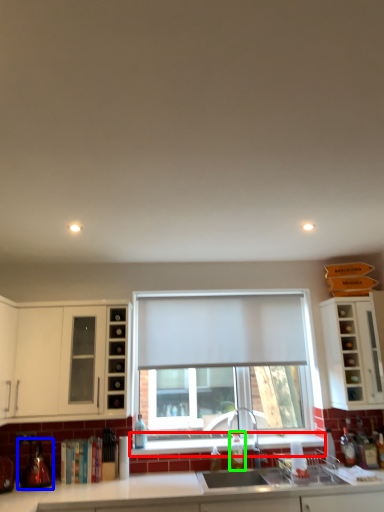
Question: Based on their relative distances, which object is nearer to window sill (highlighted by a red box)? Choose from appliance (highlighted by a blue box) and bottle (highlighted by a green box).

Choices:
 (A) appliance
 (B) bottle

Answer: (B)